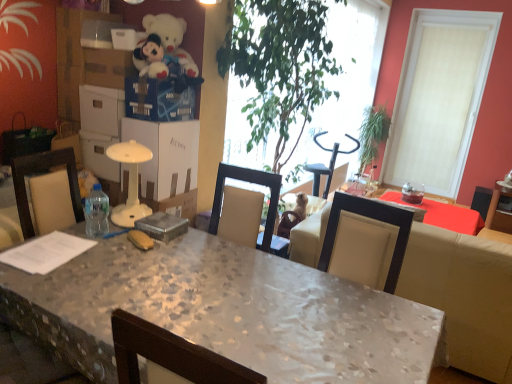
Find the location of a particular element. free space in front of metallic gray box at center is located at coordinates (149, 251).